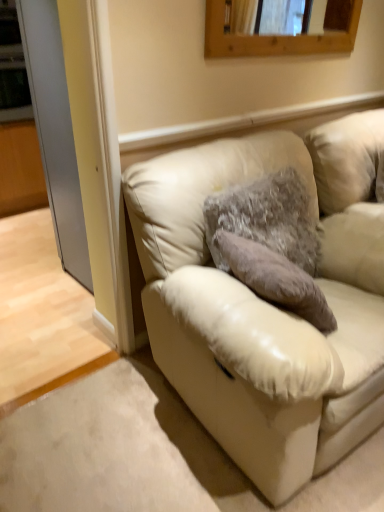
The image size is (384, 512). I want to click on unoccupied area in front of clear glass door at left, so click(x=58, y=297).